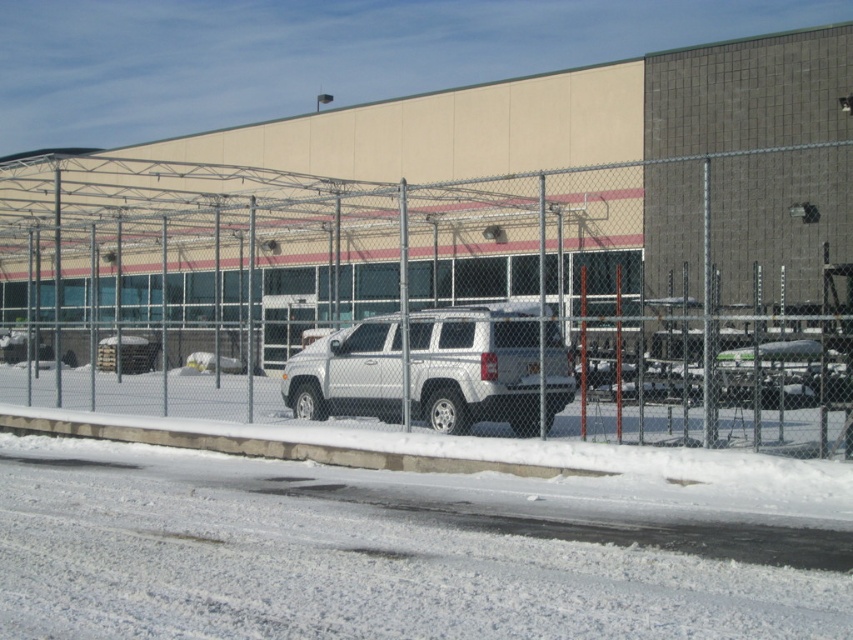
Question: Which point is farther to the camera?

Choices:
 (A) silver metallic suv at center
 (B) metal chain-link fence at center

Answer: (A)

Question: Among these objects, which one is farthest from the camera?

Choices:
 (A) silver metallic suv at center
 (B) metal chain-link fence at center

Answer: (A)

Question: Where is metal chain-link fence at center located in relation to silver metallic suv at center in the image?

Choices:
 (A) right
 (B) left

Answer: (B)

Question: Is metal chain-link fence at center smaller than silver metallic suv at center?

Choices:
 (A) yes
 (B) no

Answer: (B)

Question: Can you confirm if metal chain-link fence at center is positioned to the right of silver metallic suv at center?

Choices:
 (A) yes
 (B) no

Answer: (B)

Question: Which object is closer to the camera taking this photo?

Choices:
 (A) metal chain-link fence at center
 (B) silver metallic suv at center

Answer: (A)